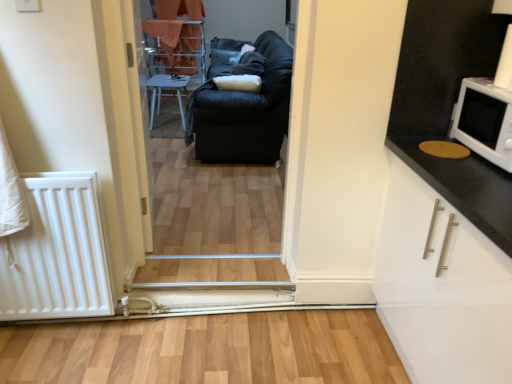
This screenshot has height=384, width=512. Identify the location of vacant space in white matte radiator at lower left (from a real-world perspective). (62, 327).